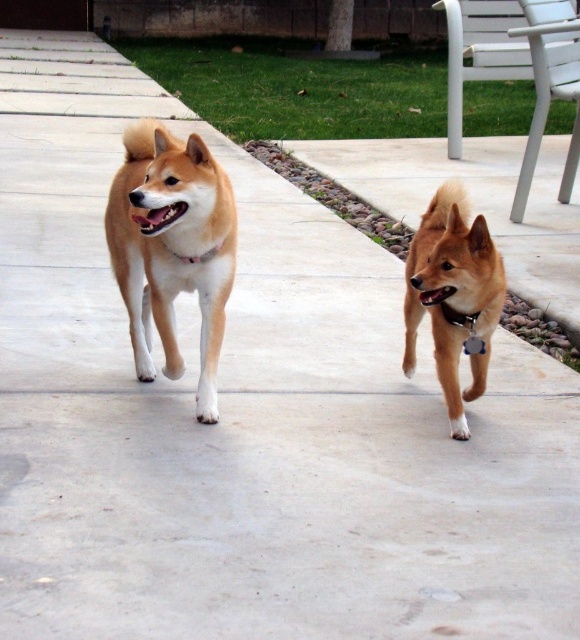
You are a photographer trying to capture a closeup of the shiny brown fur at center and the metallic silver tag at right. Since you want both subjects to be in focus, you need to know which one is taller. Can you determine which is taller?

The shiny brown fur at center has a greater height compared to the metallic silver tag at right, so you should focus on the shiny brown fur at center first as it is taller.

You are standing at the origin point in the image. Which direction should you move to reach the golden fur dog at center?

The golden fur dog at center is located at point [172,248], so you should move northeast to reach it.